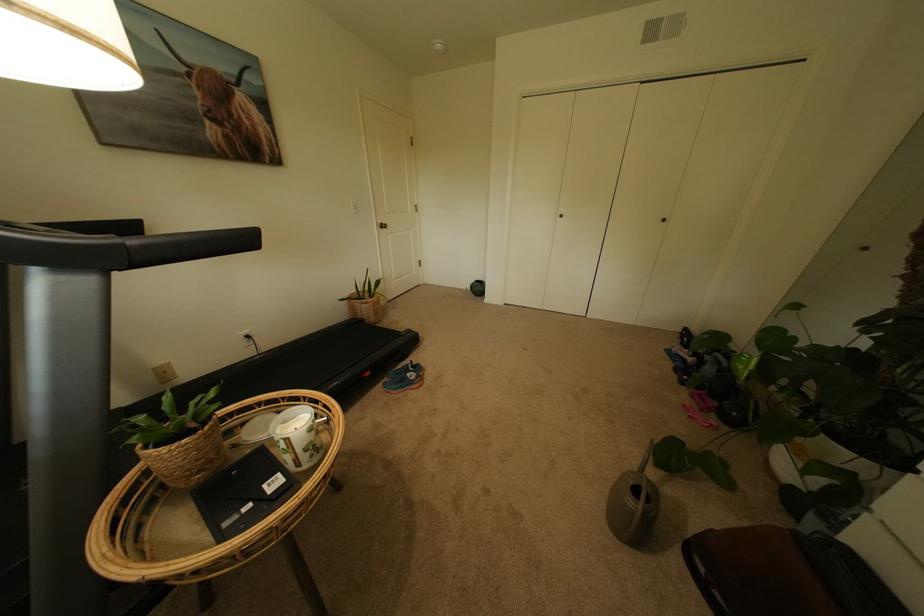
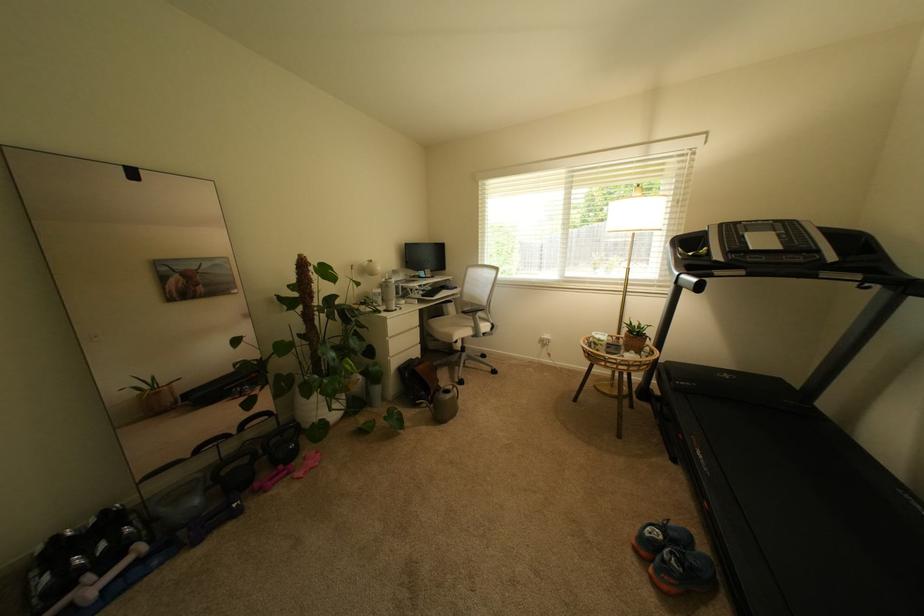
Question: I am providing you with two images of the same scene from different viewpoints. Which of the following objects are not visible in image2?

Choices:
 (A) crumpled candy wrapper
 (B) brown leather bag
 (C) treadmill handle
 (D) treadmill button

Answer: (C)